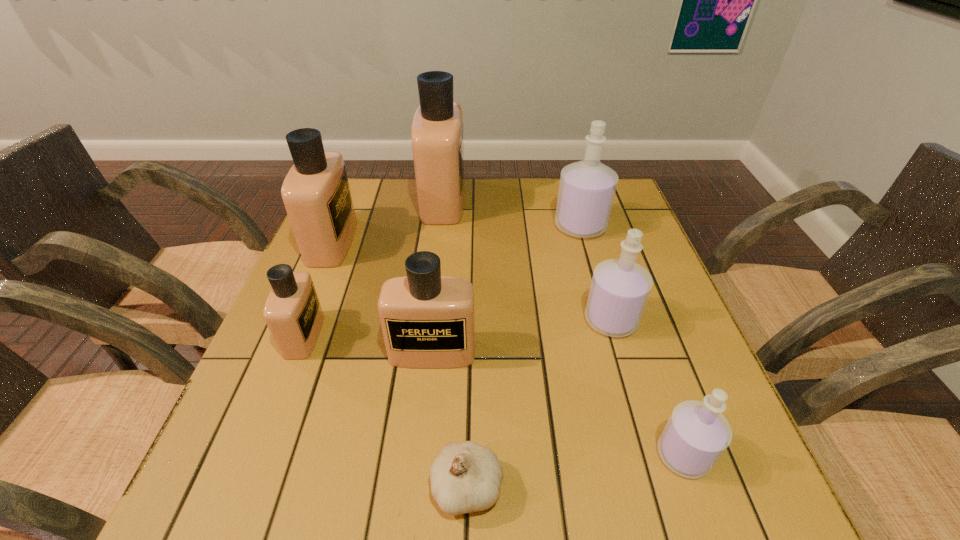
Locate which purple perfume ranks in proximity to the second biggest purple perfume. Please provide its 2D coordinates. Your answer should be formatted as a tuple, i.e. [(x, y)], where the tuple contains the x and y coordinates of a point satisfying the conditions above.

[(696, 435)]

Locate which purple perfume is the second closest to the biggest purple perfume. Please provide its 2D coordinates. Your answer should be formatted as a tuple, i.e. [(x, y)], where the tuple contains the x and y coordinates of a point satisfying the conditions above.

[(696, 435)]

Where is `free spot that satisfies the following two spatial constraints: 1. on the front label of the second biggest beige perfume; 2. on the back side of the smallest purple perfume`? The image size is (960, 540). free spot that satisfies the following two spatial constraints: 1. on the front label of the second biggest beige perfume; 2. on the back side of the smallest purple perfume is located at coordinates (245, 455).

What are the coordinates of `blank space that satisfies the following two spatial constraints: 1. on the front label of the tallest object; 2. on the back side of the shortest object` in the screenshot? It's located at (410, 487).

The height and width of the screenshot is (540, 960). I want to click on vacant space that satisfies the following two spatial constraints: 1. on the front label of the farthest purple perfume; 2. on the left side of the tallest object, so click(440, 226).

Image resolution: width=960 pixels, height=540 pixels. Find the location of `vacant region that satisfies the following two spatial constraints: 1. on the front label of the second biggest purple perfume; 2. on the left side of the tallest perfume`. vacant region that satisfies the following two spatial constraints: 1. on the front label of the second biggest purple perfume; 2. on the left side of the tallest perfume is located at coordinates (429, 320).

Where is `vacant area that satisfies the following two spatial constraints: 1. on the front side of the farthest purple perfume; 2. on the front label of the third smallest beige perfume`? The image size is (960, 540). vacant area that satisfies the following two spatial constraints: 1. on the front side of the farthest purple perfume; 2. on the front label of the third smallest beige perfume is located at coordinates (585, 242).